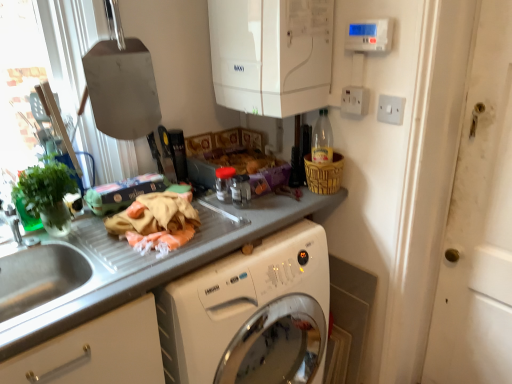
Question: Is green matte plant at left thinner than smooth gray countertop at center?

Choices:
 (A) yes
 (B) no

Answer: (A)

Question: Is the surface of green matte plant at left in direct contact with smooth gray countertop at center?

Choices:
 (A) no
 (B) yes

Answer: (A)

Question: Is smooth gray countertop at center inside green matte plant at left?

Choices:
 (A) no
 (B) yes

Answer: (A)

Question: Is green matte plant at left to the left of smooth gray countertop at center from the viewer's perspective?

Choices:
 (A) yes
 (B) no

Answer: (A)

Question: Is the position of green matte plant at left less distant than that of smooth gray countertop at center?

Choices:
 (A) yes
 (B) no

Answer: (B)

Question: From the image's perspective, is brushed metal faucet at left above or below white plastic switch at upper right, placed as the 1th electric outlet when sorted from right to left?

Choices:
 (A) above
 (B) below

Answer: (B)

Question: From a real-world perspective, is brushed metal faucet at left positioned above or below white plastic switch at upper right, acting as the 2th electric outlet starting from the left?

Choices:
 (A) above
 (B) below

Answer: (B)

Question: Is brushed metal faucet at left bigger or smaller than white plastic switch at upper right, placed as the 1th electric outlet when sorted from right to left?

Choices:
 (A) small
 (B) big

Answer: (B)

Question: Considering the positions of brushed metal faucet at left and white plastic switch at upper right, acting as the 2th electric outlet starting from the left, in the image, is brushed metal faucet at left wider or thinner than white plastic switch at upper right, acting as the 2th electric outlet starting from the left,?

Choices:
 (A) wide
 (B) thin

Answer: (A)

Question: Choose the correct answer: Is woven brown basket at upper right inside green matte plant at left or outside it?

Choices:
 (A) outside
 (B) inside

Answer: (A)

Question: Looking at the image, does woven brown basket at upper right seem bigger or smaller compared to green matte plant at left?

Choices:
 (A) big
 (B) small

Answer: (B)

Question: Is point (328, 183) positioned closer to the camera than point (25, 203)?

Choices:
 (A) closer
 (B) farther

Answer: (B)

Question: From the image's perspective, relative to green matte plant at left, is woven brown basket at upper right above or below?

Choices:
 (A) below
 (B) above

Answer: (B)

Question: In terms of width, does smooth gray countertop at center look wider or thinner when compared to white plastic switch at upper right, placed as the 1th electric outlet when sorted from right to left?

Choices:
 (A) thin
 (B) wide

Answer: (B)

Question: Is smooth gray countertop at center in front of or behind white plastic switch at upper right, acting as the 2th electric outlet starting from the left, in the image?

Choices:
 (A) behind
 (B) front

Answer: (B)